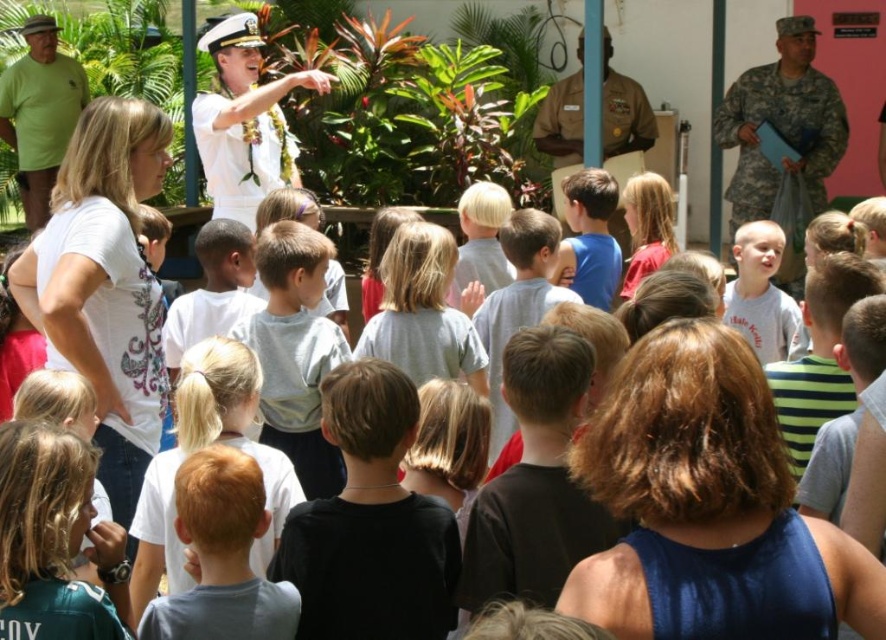
Question: Can you confirm if blue fabric tank top at center is wider than light brown hair at center?

Choices:
 (A) yes
 (B) no

Answer: (A)

Question: Which point is closer to the camera?

Choices:
 (A) white cotton shirt at center
 (B) light brown hair at center
 (C) black matte shirt at center

Answer: (B)

Question: Among these objects, which one is nearest to the camera?

Choices:
 (A) light gray shirt at center
 (B) blue cotton shirt at center
 (C) blue fabric tank top at center

Answer: (C)

Question: Which point appears farthest from the camera in this image?

Choices:
 (A) (255, 128)
 (B) (471, 342)

Answer: (A)

Question: Can you confirm if camouflage uniform at upper center is positioned below blue cotton shirt at center?

Choices:
 (A) yes
 (B) no

Answer: (B)

Question: Is gray cotton shirt at center positioned before light gray cotton shirt at center?

Choices:
 (A) no
 (B) yes

Answer: (B)